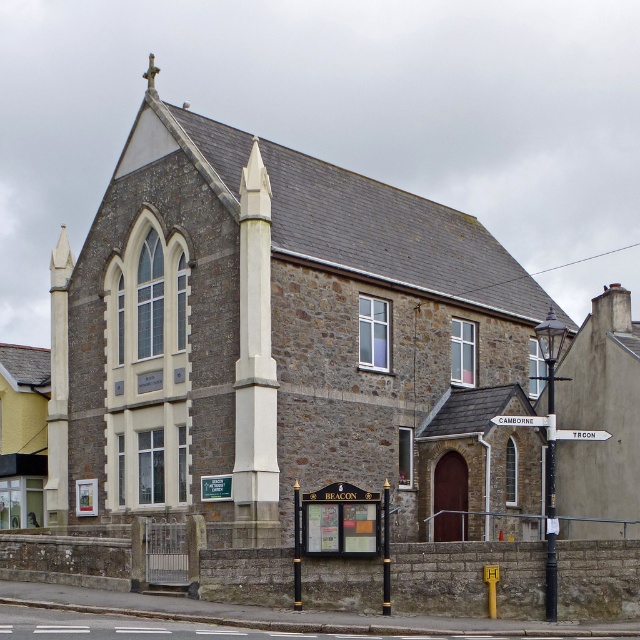
Which of these two, white stone obelisk at center or white plastic street sign at upper center, stands taller?

Standing taller between the two is white stone obelisk at center.

Is point (268, 484) positioned in front of point (595, 435)?

No, (268, 484) is further to viewer.

Identify the location of white stone obelisk at center. (253, 369).

Who is higher up, white wooden signpost at upper center or white plastic street sign at upper center?

white wooden signpost at upper center is above.

Is point (506, 416) positioned before point (595, 435)?

No, it is not.

You are a GUI agent. You are given a task and a screenshot of the screen. Output one action in this format:
    pyautogui.click(x=<x>, y=<y>)
    Task: Click on the white wooden signpost at upper center
    The width and height of the screenshot is (640, 640).
    Given the screenshot: What is the action you would take?
    pyautogui.click(x=518, y=420)

The width and height of the screenshot is (640, 640). Identify the location of white wooden signpost at upper center. (518, 420).

Can you confirm if white stone obelisk at center is shorter than white wooden signpost at upper center?

Incorrect, white stone obelisk at center's height does not fall short of white wooden signpost at upper center's.

Between white stone obelisk at center and white wooden signpost at upper center, which one has less height?

With less height is white wooden signpost at upper center.

Image resolution: width=640 pixels, height=640 pixels. What do you see at coordinates (253, 369) in the screenshot? I see `white stone obelisk at center` at bounding box center [253, 369].

The image size is (640, 640). Identify the location of white stone obelisk at center. (253, 369).